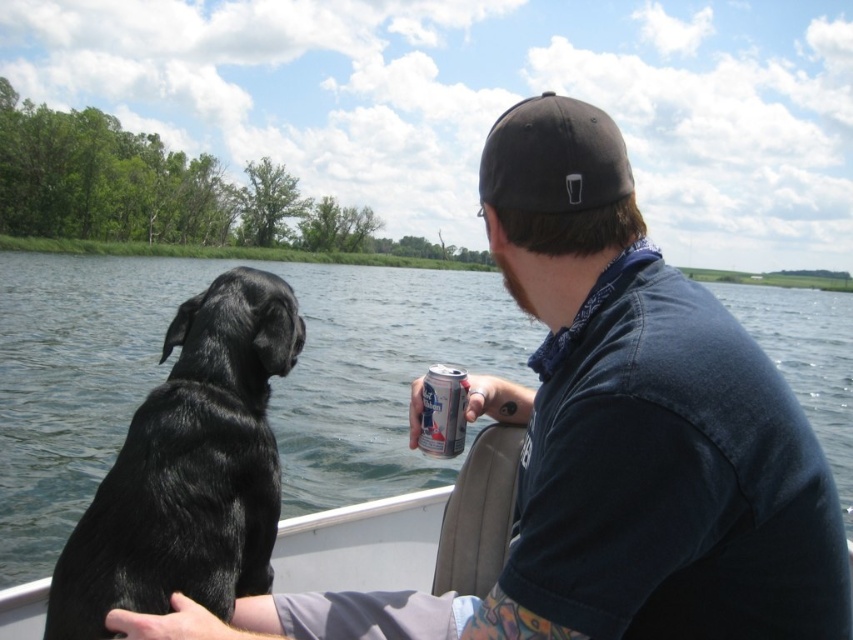
You are a delivery drone that needs to drop a package onto the boat. The package must land between the black shiny fur dog at left and the silver metallic can at center. Is there enough space for the package to fit in that area?

The distance between the black shiny fur dog at left and the silver metallic can at center is 24.06 inches, so the package can fit as long as it is smaller than that distance.

You are a photographer trying to capture the black shiny fur dog at left and the man holding a can of beer in his right hand. Based on their positions, which object is closer to the center of the image?

The black shiny fur dog at left is located at point (189, 468), which is closer to the center of the image compared to the man holding a can of beer in his right hand.

In the scene shown: You are a photographer taking a picture of the scene. You want to focus on the black shiny fur dog at left and the black fabric baseball cap at upper center. Which object should you adjust your camera focus on first to ensure both are in focus?

Since the black shiny fur dog at left is closer to the viewer than the black fabric baseball cap at upper center, you should focus on the dog first. This way, the cap will naturally come into focus as it is further back.